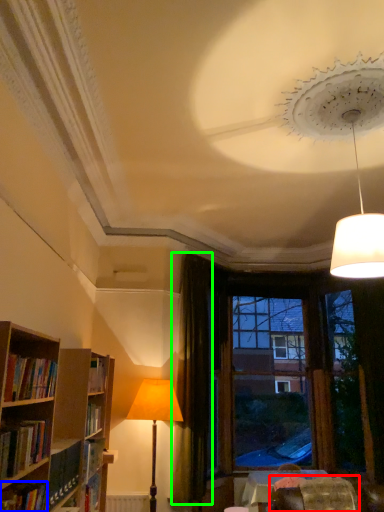
Question: Based on their relative distances, which object is nearer to swivel chair (highlighted by a red box)? Choose from book (highlighted by a blue box) and curtain (highlighted by a green box).

Choices:
 (A) book
 (B) curtain

Answer: (B)